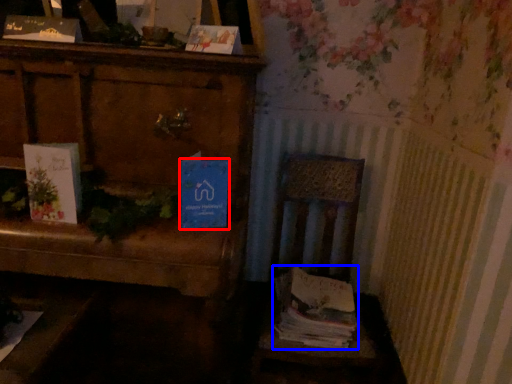
Question: Which object is closer to the camera taking this photo, paperback book (highlighted by a red box) or magazine (highlighted by a blue box)?

Choices:
 (A) paperback book
 (B) magazine

Answer: (A)